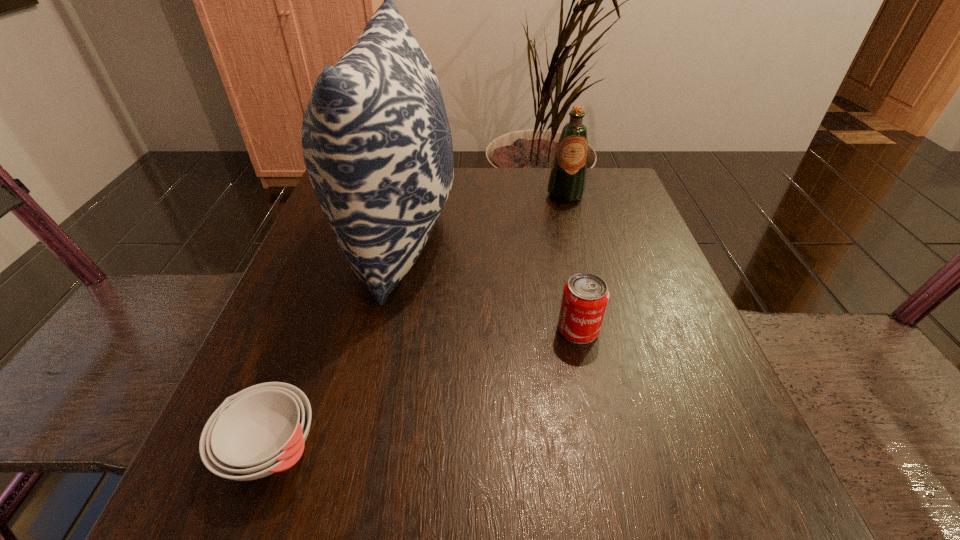
In the image, there is a desktop. Identify the location of vacant space at the near edge. The image size is (960, 540). (377, 481).

In the image, there is a desktop. Where is `vacant space at the left edge`? The height and width of the screenshot is (540, 960). vacant space at the left edge is located at coordinates (334, 256).

Find the location of a particular element. This screenshot has height=540, width=960. vacant space at the right edge of the desktop is located at coordinates (645, 228).

Locate an element on the screen. This screenshot has width=960, height=540. vacant point at the far right corner is located at coordinates (569, 208).

The height and width of the screenshot is (540, 960). What are the coordinates of `free space between the soup bowl and the tallest object` in the screenshot? It's located at (335, 342).

Locate an element on the screen. free space between the can and the olive oil is located at coordinates (572, 262).

Identify the location of free space that is in between the soup bowl and the cushion. Image resolution: width=960 pixels, height=540 pixels. (335, 342).

Locate an element on the screen. free spot between the olive oil and the cushion is located at coordinates (482, 215).

Locate an element on the screen. Image resolution: width=960 pixels, height=540 pixels. free spot between the shortest object and the second shortest object is located at coordinates (424, 389).

Where is `vacant region between the cushion and the can`? vacant region between the cushion and the can is located at coordinates (489, 282).